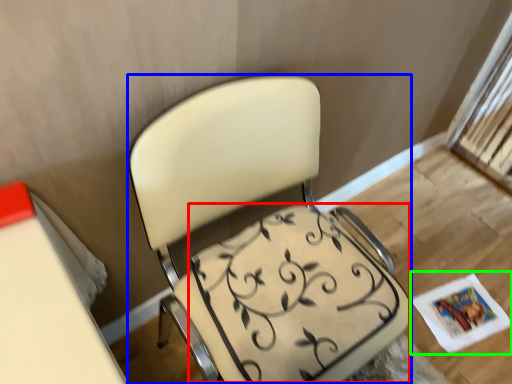
Question: Considering the real-world distances, which object is farthest from swivel chair (highlighted by a red box)? chair (highlighted by a blue box) or magazine (highlighted by a green box)?

Choices:
 (A) chair
 (B) magazine

Answer: (B)